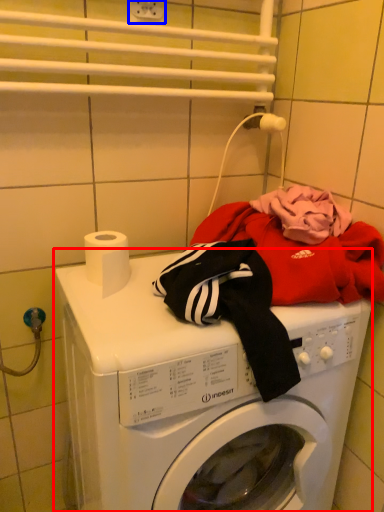
Question: Which point is closer to the camera, washing machine (highlighted by a red box) or electric outlet (highlighted by a blue box)?

Choices:
 (A) washing machine
 (B) electric outlet

Answer: (A)